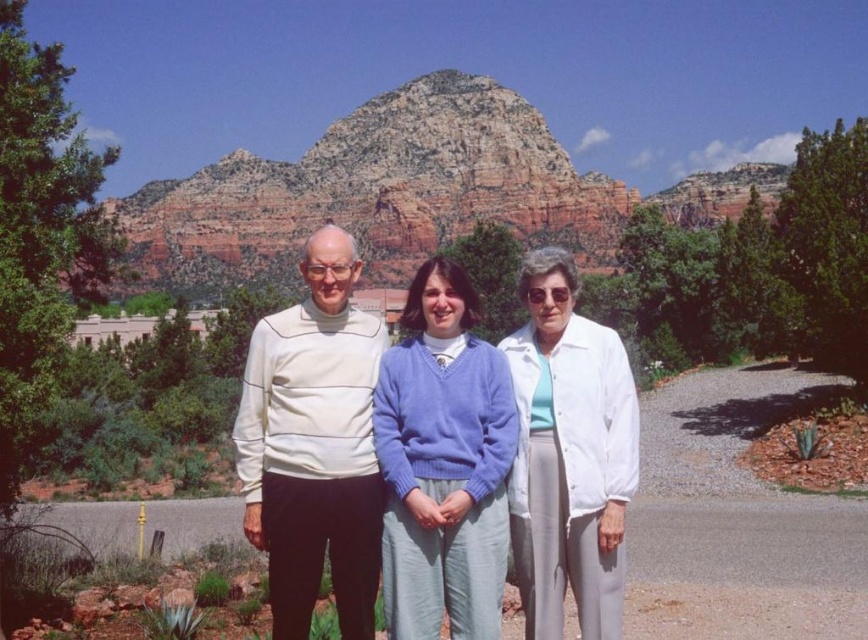
Question: Which point is farther from the camera taking this photo?

Choices:
 (A) (467, 348)
 (B) (513, 428)
 (C) (237, 164)

Answer: (C)

Question: Does white turtleneck sweater at left appear on the left side of matte blue sweater at center?

Choices:
 (A) yes
 (B) no

Answer: (A)

Question: Can you confirm if rustic rock formation at center is thinner than white matte sweater at center?

Choices:
 (A) yes
 (B) no

Answer: (B)

Question: Can you confirm if white turtleneck sweater at left is positioned to the right of white matte sweater at center?

Choices:
 (A) yes
 (B) no

Answer: (B)

Question: Which object is closer to the camera taking this photo?

Choices:
 (A) white cotton jacket at center
 (B) rustic rock formation at center

Answer: (A)

Question: Considering the real-world distances, which object is closest to the white matte sweater at center?

Choices:
 (A) white cotton jacket at center
 (B) matte blue sweater at center
 (C) white turtleneck sweater at left

Answer: (B)